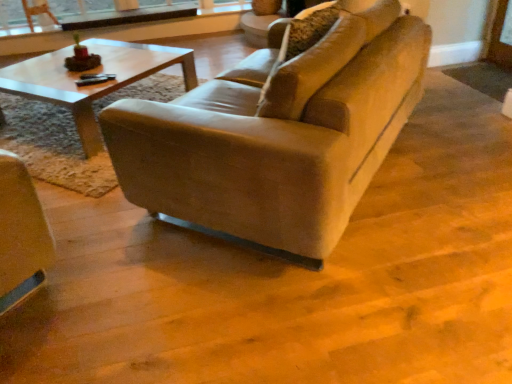
Question: Is clear glass window frame at upper center surrounding matte brown armchair at upper left?

Choices:
 (A) no
 (B) yes

Answer: (A)

Question: From the image's perspective, is clear glass window frame at upper center below matte brown armchair at upper left?

Choices:
 (A) no
 (B) yes

Answer: (B)

Question: Can you confirm if clear glass window frame at upper center is positioned to the left of matte brown armchair at upper left?

Choices:
 (A) no
 (B) yes

Answer: (A)

Question: Is clear glass window frame at upper center turned away from matte brown armchair at upper left?

Choices:
 (A) no
 (B) yes

Answer: (A)

Question: From the image's perspective, would you say clear glass window frame at upper center is positioned over matte brown armchair at upper left?

Choices:
 (A) no
 (B) yes

Answer: (A)

Question: Based on their sizes in the image, would you say leather couch at center is bigger or smaller than clear glass window frame at upper center?

Choices:
 (A) big
 (B) small

Answer: (A)

Question: Considering the relative positions of leather couch at center and clear glass window frame at upper center in the image provided, is leather couch at center to the left or to the right of clear glass window frame at upper center?

Choices:
 (A) right
 (B) left

Answer: (A)

Question: Is leather couch at center taller or shorter than clear glass window frame at upper center?

Choices:
 (A) tall
 (B) short

Answer: (A)

Question: Is leather couch at center in front of or behind clear glass window frame at upper center in the image?

Choices:
 (A) behind
 (B) front

Answer: (B)

Question: Is matte brown armchair at upper left bigger or smaller than clear glass window frame at upper center?

Choices:
 (A) big
 (B) small

Answer: (B)

Question: Based on their positions, is matte brown armchair at upper left located to the left or right of clear glass window frame at upper center?

Choices:
 (A) right
 (B) left

Answer: (B)

Question: In the image, is matte brown armchair at upper left positioned in front of or behind clear glass window frame at upper center?

Choices:
 (A) behind
 (B) front

Answer: (B)

Question: In terms of width, does matte brown armchair at upper left look wider or thinner when compared to clear glass window frame at upper center?

Choices:
 (A) wide
 (B) thin

Answer: (B)

Question: Is leather couch at center bigger or smaller than matte brown armchair at upper left?

Choices:
 (A) big
 (B) small

Answer: (A)

Question: From their relative heights in the image, would you say leather couch at center is taller or shorter than matte brown armchair at upper left?

Choices:
 (A) short
 (B) tall

Answer: (B)